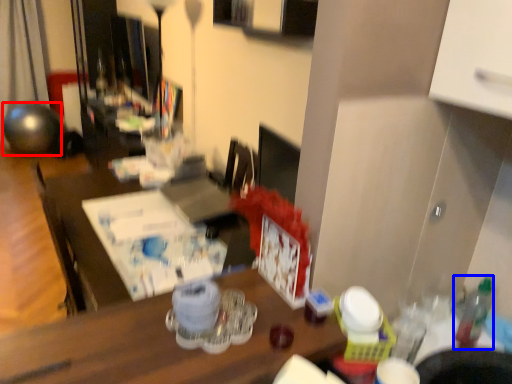
Question: Which object appears farthest to the camera in this image, ball (highlighted by a red box) or bottle (highlighted by a blue box)?

Choices:
 (A) ball
 (B) bottle

Answer: (A)